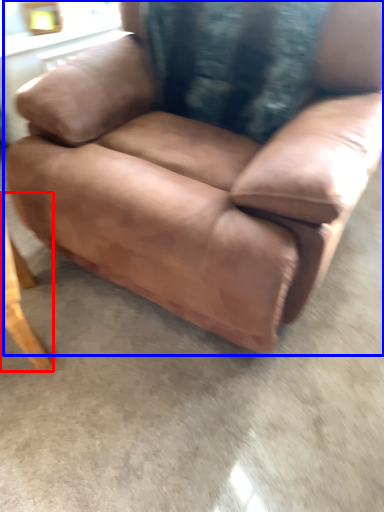
Question: Among these objects, which one is farthest to the camera, table (highlighted by a red box) or chair (highlighted by a blue box)?

Choices:
 (A) table
 (B) chair

Answer: (A)